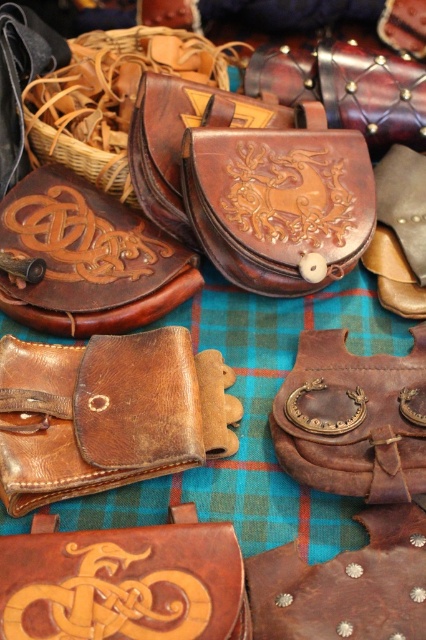
You are a medieval merchant examining the leather goods displayed on the tartan cloth. You notice a point marked at coordinates (88, 259). Can you identify what object is located at this point?

The point at coordinates (88, 259) corresponds to the brown leather pouch at upper left.

You are an appraiser examining the leather goods displayed on the tartan cloth. There are two points marked on the image at coordinates point (31, 284) and point (334, 424). Which of these points is closer to you as you look at the image?

Point (31, 284) is closer to you than point (334, 424) because it is further to the viewer.